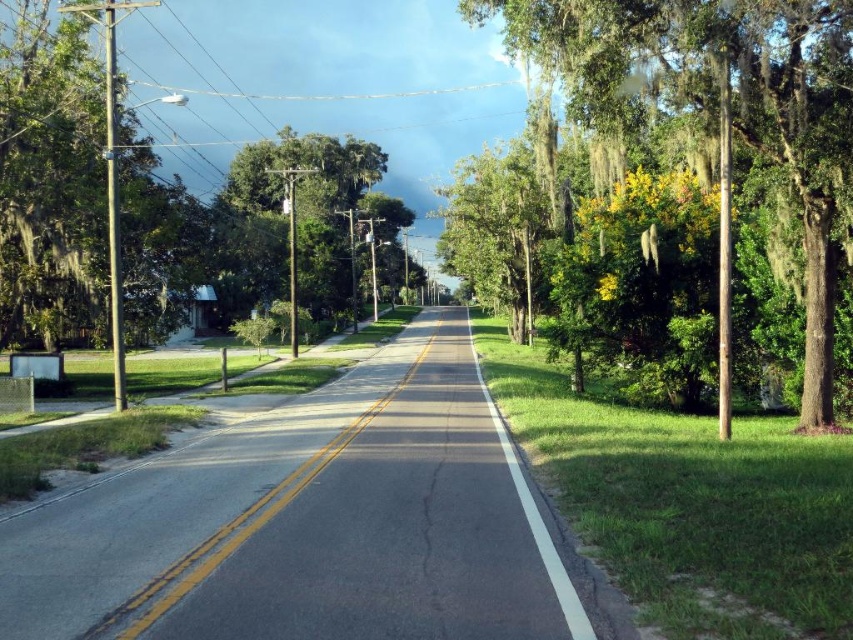
Is green leafy tree at right below green leafy tree at center?

Correct, green leafy tree at right is located below green leafy tree at center.

Who is lower down, green leafy tree at right or green leafy tree at center?

Positioned lower is green leafy tree at right.

Locate an element on the screen. green leafy tree at right is located at coordinates (730, 116).

The image size is (853, 640). I want to click on green leafy tree at right, so click(x=730, y=116).